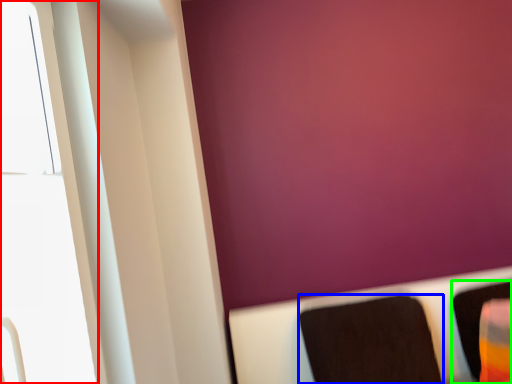
Question: Which is farther away from window (highlighted by a red box)? furniture (highlighted by a blue box) or furniture (highlighted by a green box)?

Choices:
 (A) furniture
 (B) furniture

Answer: (B)